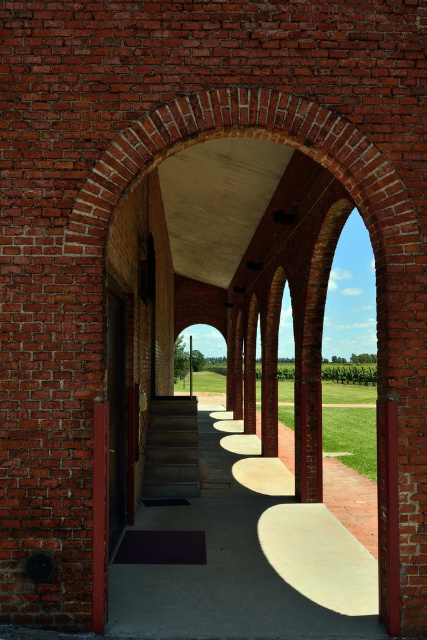
Question: From the image, what is the correct spatial relationship of concrete sidewalk at center in relation to concrete stairs at center?

Choices:
 (A) left
 (B) right

Answer: (B)

Question: Does concrete sidewalk at center lie behind concrete stairs at center?

Choices:
 (A) yes
 (B) no

Answer: (B)

Question: Is concrete sidewalk at center to the right of concrete stairs at center from the viewer's perspective?

Choices:
 (A) no
 (B) yes

Answer: (B)

Question: Which point is farther to the camera?

Choices:
 (A) concrete sidewalk at center
 (B) concrete stairs at center

Answer: (B)

Question: Which point is farther to the camera?

Choices:
 (A) concrete stairs at center
 (B) concrete sidewalk at center

Answer: (A)